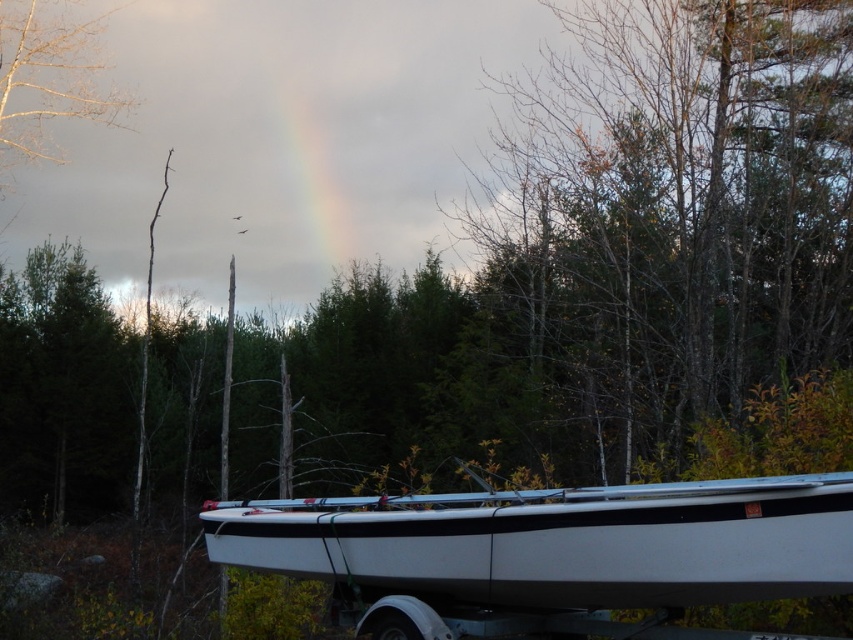
Looking at this image, who is taller, bare branches at center or white matte boat at lower center?

bare branches at center is taller.

Which of these two, bare branches at center or white matte boat at lower center, stands shorter?

Standing shorter between the two is white matte boat at lower center.

Based on the photo, who is more forward, (625, 298) or (675, 593)?

Point (675, 593) is more forward.

Find the location of a particular element. This screenshot has width=853, height=640. bare branches at center is located at coordinates (674, 211).

Is bare branches at center taller than bare branches at upper left?

Yes.

From the picture: Does bare branches at center lie behind bare branches at upper left?

No, it is not.

The width and height of the screenshot is (853, 640). I want to click on bare branches at center, so click(x=674, y=211).

How far apart are white matte boat at lower center and bare branches at upper left?

The distance of white matte boat at lower center from bare branches at upper left is 29.06 meters.

Between point (602, 605) and point (64, 102), which one is positioned behind?

The point (64, 102) is behind.

Who is more forward, (666, 556) or (27, 38)?

Point (666, 556) is in front.

Locate an element on the screen. This screenshot has width=853, height=640. white matte boat at lower center is located at coordinates (560, 541).